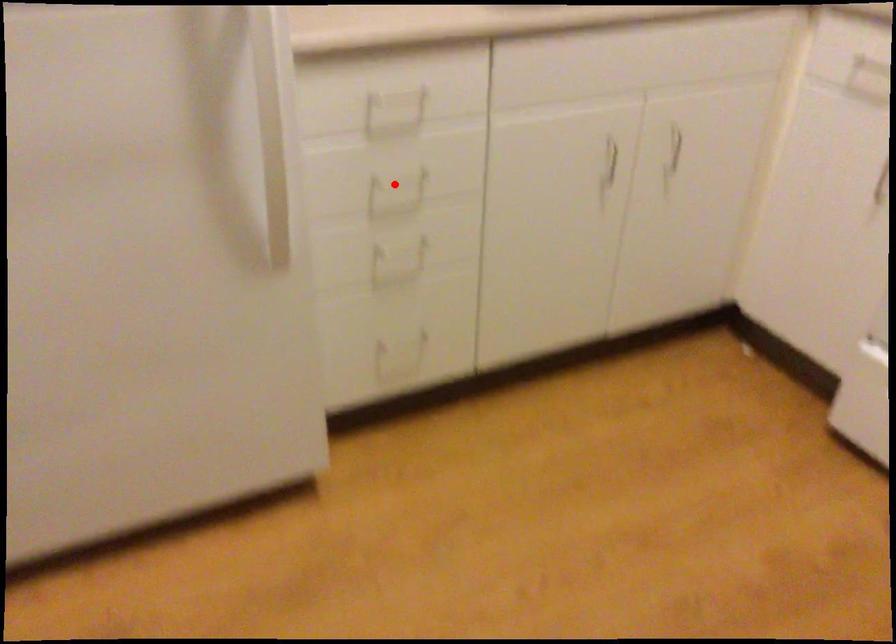
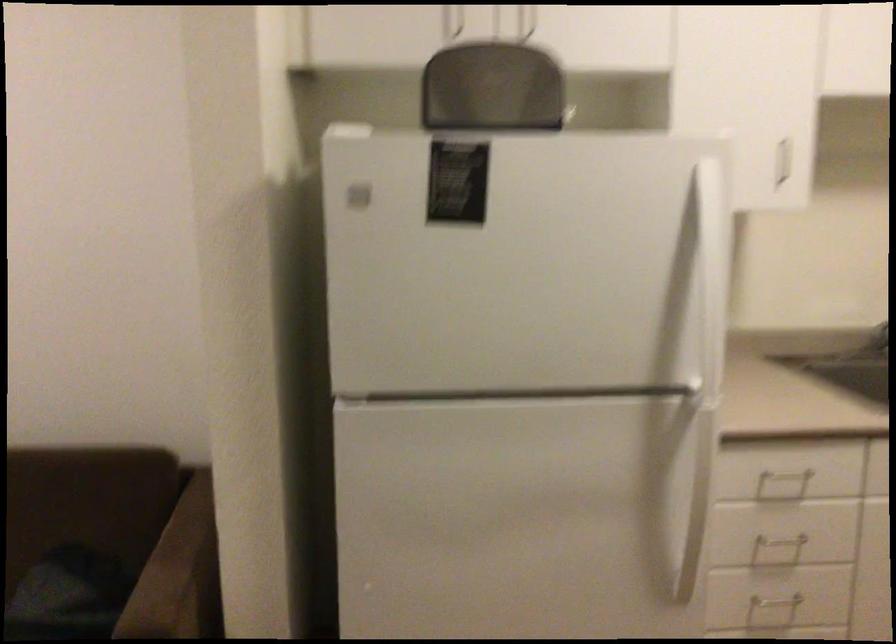
Locate, in the second image, the point that corresponds to the highlighted location in the first image.

(778, 547)